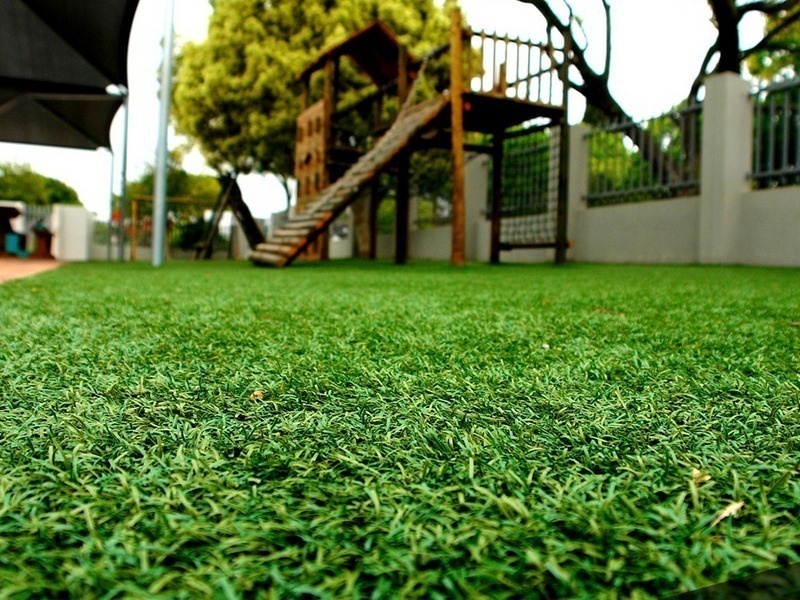
The height and width of the screenshot is (600, 800). What are the coordinates of `wall` in the screenshot? It's located at (653, 222).